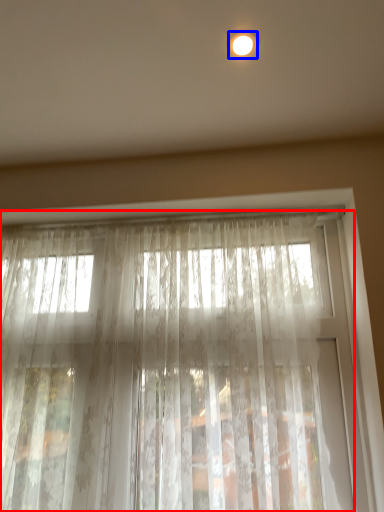
Question: Which object is further to the camera taking this photo, curtain (highlighted by a red box) or lighting (highlighted by a blue box)?

Choices:
 (A) curtain
 (B) lighting

Answer: (A)